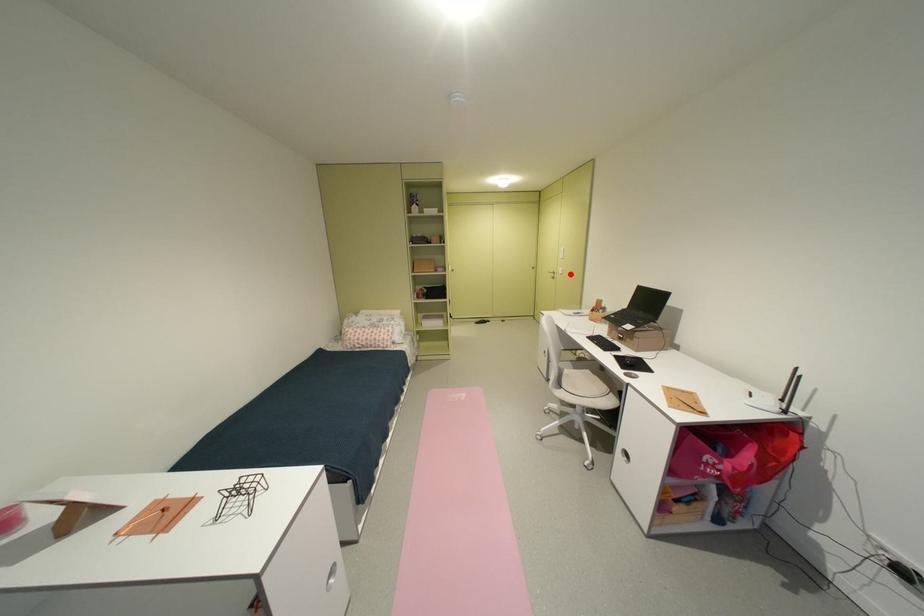
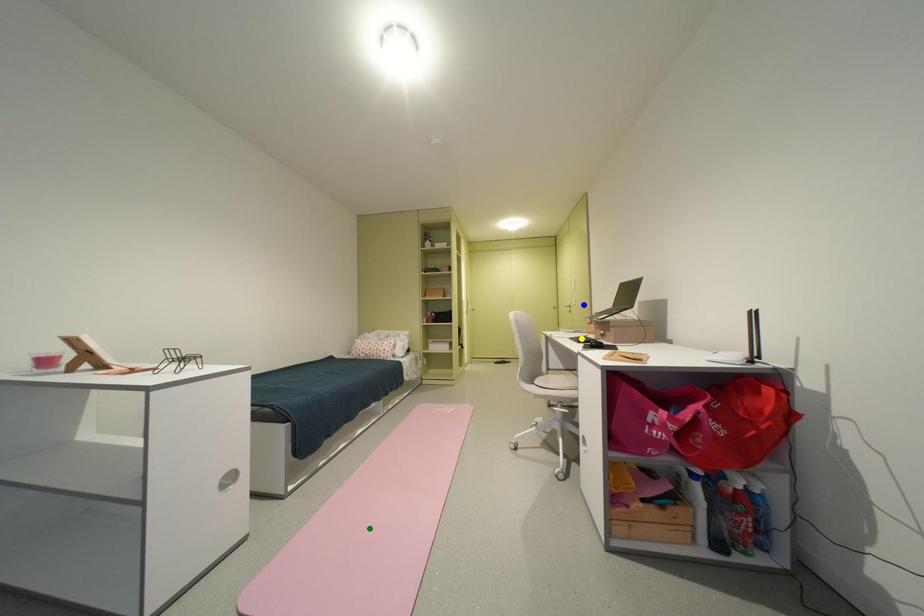
Question: I am providing you with two images of the same scene from different viewpoints. A red point is marked on the first image. You are given multiple points on the second image. Which point in image 2 represents the same 3d spot as the red point in image 1?

Choices:
 (A) blue point
 (B) yellow point
 (C) green point

Answer: (A)